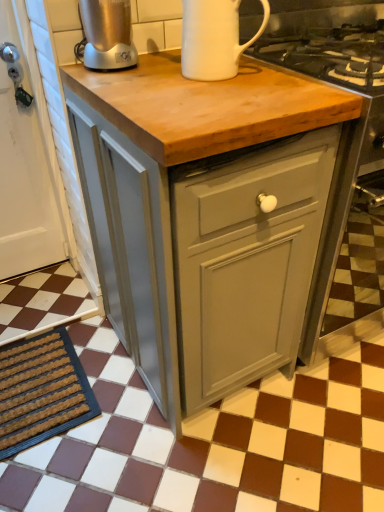
This screenshot has height=512, width=384. Identify the location of free space that is in between brushed metal blender at upper left, which is the 1th kitchen appliance from left to right, and white ceramic mug at upper center, the first kitchen appliance from the right. (155, 67).